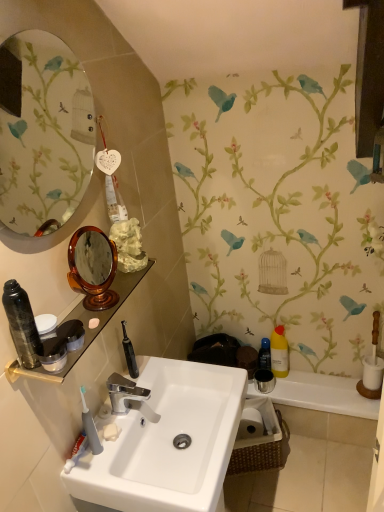
This screenshot has height=512, width=384. In order to click on white glossy sink at center in this screenshot , I will do `click(166, 441)`.

What do you see at coordinates (90, 426) in the screenshot? I see `gray rubber toothbrush at lower left` at bounding box center [90, 426].

The image size is (384, 512). What do you see at coordinates (22, 324) in the screenshot?
I see `shiny black canister at left, which appears as the 1th toiletry when viewed from the left` at bounding box center [22, 324].

The width and height of the screenshot is (384, 512). What do you see at coordinates (264, 355) in the screenshot?
I see `transparent plastic bottle at lower right, which appears as the first toiletry when viewed from the back` at bounding box center [264, 355].

Locate an element on the screen. This screenshot has height=512, width=384. polished chrome faucet at center is located at coordinates (129, 397).

In the scene shown: Who is smaller, polished chrome faucet at center or yellow translucent bottle at right, arranged as the 1th toiletry when viewed from the right?

polished chrome faucet at center is smaller.

Would you say polished chrome faucet at center contains yellow translucent bottle at right, acting as the 3th toiletry starting from the front?

No, yellow translucent bottle at right, acting as the 3th toiletry starting from the front, is not surrounded by polished chrome faucet at center.

Who is shorter, polished chrome faucet at center or yellow translucent bottle at right, the 4th toiletry when ordered from left to right?

With less height is polished chrome faucet at center.

Which of these two, polished chrome faucet at center or yellow translucent bottle at right, the 4th toiletry when ordered from left to right, is wider?

polished chrome faucet at center.

Can you confirm if gray rubber toothbrush at lower left is smaller than polished chrome faucet at center?

Correct, gray rubber toothbrush at lower left occupies less space than polished chrome faucet at center.

This screenshot has width=384, height=512. I want to click on toothbrush above the polished chrome faucet at center (from a real-world perspective), so click(x=90, y=426).

Can you confirm if gray rubber toothbrush at lower left is taller than polished chrome faucet at center?

Yes.

Based on the photo, how many degrees apart are the facing directions of shiny black canister at left, which appears as the 1th toiletry when viewed from the left, and oval glass mirror at upper left?

The angular difference between shiny black canister at left, which appears as the 1th toiletry when viewed from the left, and oval glass mirror at upper left is 0.85 degrees.

Considering the sizes of objects shiny black canister at left, placed as the 4th toiletry when sorted from right to left, and oval glass mirror at upper left in the image provided, who is taller, shiny black canister at left, placed as the 4th toiletry when sorted from right to left, or oval glass mirror at upper left?

With more height is oval glass mirror at upper left.

Does shiny black canister at left, which is the 1th toiletry from front to back, turn towards oval glass mirror at upper left?

No, shiny black canister at left, which is the 1th toiletry from front to back, is not aimed at oval glass mirror at upper left.

Does point (31, 333) come farther from viewer compared to point (65, 135)?

No, it is in front of (65, 135).

Between yellow translucent bottle at right, arranged as the 1th toiletry when viewed from the right, and oval glass mirror at upper left, which one has larger size?

oval glass mirror at upper left is bigger.

Who is taller, yellow translucent bottle at right, the 4th toiletry when ordered from left to right, or oval glass mirror at upper left?

oval glass mirror at upper left.

Find the location of a particular element. mirror lying on the left of yellow translucent bottle at right, arranged as the second toiletry when viewed from the back is located at coordinates (46, 135).

From the image's perspective, between yellow translucent bottle at right, the 4th toiletry when ordered from left to right, and oval glass mirror at upper left, which one is located above?

oval glass mirror at upper left, from the image's perspective.

Does metallic silver cup at right have a lesser height compared to transparent plastic bottle at lower right, which appears as the first toiletry when viewed from the back?

Correct, metallic silver cup at right is not as tall as transparent plastic bottle at lower right, which appears as the first toiletry when viewed from the back.

Is there a large distance between metallic silver cup at right and transparent plastic bottle at lower right, arranged as the third toiletry when viewed from the left?

Actually, metallic silver cup at right and transparent plastic bottle at lower right, arranged as the third toiletry when viewed from the left, are a little close together.

From a real-world perspective, between metallic silver cup at right and transparent plastic bottle at lower right, which appears as the first toiletry when viewed from the back, who is vertically lower?

In real-world perspective, metallic silver cup at right is lower.

In terms of width, does metallic silver cup at right look wider or thinner when compared to transparent plastic bottle at lower right, the 2th toiletry when ordered from right to left?

Clearly, metallic silver cup at right has more width compared to transparent plastic bottle at lower right, the 2th toiletry when ordered from right to left.

Can we say gray rubber toothbrush at lower left lies outside metallic silver cup at right?

That's correct, gray rubber toothbrush at lower left is outside of metallic silver cup at right.

What's the angular difference between gray rubber toothbrush at lower left and metallic silver cup at right's facing directions?

The angular difference between gray rubber toothbrush at lower left and metallic silver cup at right is 141 degrees.

Can you see gray rubber toothbrush at lower left touching metallic silver cup at right?

No, gray rubber toothbrush at lower left is not in contact with metallic silver cup at right.

Is black plastic toothbrush at center, the 2th toiletry from the front, spatially inside white glossy sink at center, or outside of it?

black plastic toothbrush at center, the 2th toiletry from the front, is not enclosed by white glossy sink at center.

In the image, is black plastic toothbrush at center, the 2th toiletry from the front, positioned in front of or behind white glossy sink at center?

Visually, black plastic toothbrush at center, the 2th toiletry from the front, is located behind white glossy sink at center.

Does black plastic toothbrush at center, the third toiletry in the right-to-left sequence, have a lesser height compared to white glossy sink at center?

Yes.

Considering the points (126, 339) and (180, 362), which point is behind, point (126, 339) or point (180, 362)?

The point (126, 339) is more distant.

Where is `tap that is on the left side of yellow translucent bottle at right, arranged as the 1th toiletry when viewed from the right`? tap that is on the left side of yellow translucent bottle at right, arranged as the 1th toiletry when viewed from the right is located at coordinates (129, 397).

What are the coordinates of `tap that is behind the gray rubber toothbrush at lower left` in the screenshot? It's located at (129, 397).

Which object lies nearer to the anchor point transparent plastic bottle at lower right, which appears as the first toiletry when viewed from the back, yellow translucent bottle at right, arranged as the second toiletry when viewed from the back, or shiny black canister at left, which is the 4th toiletry in back-to-front order?

yellow translucent bottle at right, arranged as the second toiletry when viewed from the back, is closer to transparent plastic bottle at lower right, which appears as the first toiletry when viewed from the back.

Considering their positions, is yellow translucent bottle at right, acting as the 3th toiletry starting from the front, positioned closer to white glossy sink at center than oval glass mirror at upper left?

Based on the image, yellow translucent bottle at right, acting as the 3th toiletry starting from the front, appears to be nearer to white glossy sink at center.

Looking at the image, which one is located further to transparent plastic bottle at lower right, which appears as the first toiletry when viewed from the back, metallic silver cup at right or polished chrome faucet at center?

Among the two, polished chrome faucet at center is located further to transparent plastic bottle at lower right, which appears as the first toiletry when viewed from the back.

When comparing their distances from polished chrome faucet at center, does oval glass mirror at upper left or metallic silver cup at right seem closer?

metallic silver cup at right is positioned closer to the anchor polished chrome faucet at center.

From the image, which object appears to be farther from polished chrome faucet at center, metallic silver cup at right or shiny black canister at left, which is the 4th toiletry in back-to-front order?

Based on the image, metallic silver cup at right appears to be further to polished chrome faucet at center.

From the image, which object appears to be nearer to black plastic toothbrush at center, placed as the second toiletry when sorted from left to right, shiny black canister at left, which appears as the 1th toiletry when viewed from the left, or gray rubber toothbrush at lower left?

gray rubber toothbrush at lower left lies closer to black plastic toothbrush at center, placed as the second toiletry when sorted from left to right, than the other object.

Considering their positions, is polished chrome faucet at center positioned further to shiny black canister at left, which is the 1th toiletry from front to back, than gray rubber toothbrush at lower left?

polished chrome faucet at center is positioned further to the anchor shiny black canister at left, which is the 1th toiletry from front to back.

Estimate the real-world distances between objects in this image. Which object is further from metallic silver cup at right, polished chrome faucet at center or yellow translucent bottle at right, arranged as the second toiletry when viewed from the back?

polished chrome faucet at center is further to metallic silver cup at right.

The height and width of the screenshot is (512, 384). I want to click on toothbrush positioned between white glossy sink at center and metallic silver cup at right from near to far, so click(90, 426).

Where is `bath between white glossy sink at center and transparent plastic bottle at lower right, the 2th toiletry when ordered from right to left, in the front-back direction`? The image size is (384, 512). bath between white glossy sink at center and transparent plastic bottle at lower right, the 2th toiletry when ordered from right to left, in the front-back direction is located at coordinates (320, 394).

Identify the location of toiletry between black plastic toothbrush at center, which is the 3th toiletry in back-to-front order, and transparent plastic bottle at lower right, the fourth toiletry when ordered from front to back, along the z-axis. The width and height of the screenshot is (384, 512). (279, 352).

Where is `tap located between shiny black canister at left, which is the 4th toiletry in back-to-front order, and metallic silver cup at right in the left-right direction`? The height and width of the screenshot is (512, 384). tap located between shiny black canister at left, which is the 4th toiletry in back-to-front order, and metallic silver cup at right in the left-right direction is located at coordinates (129, 397).